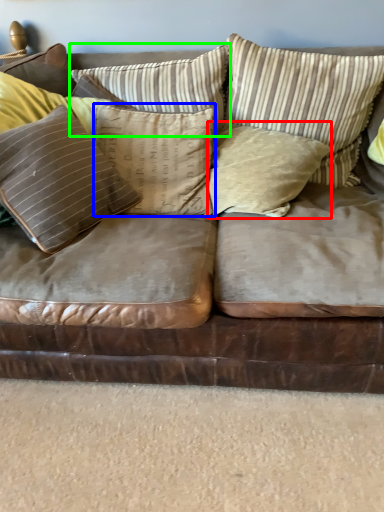
Question: Considering the real-world distances, which object is farthest from pillow (highlighted by a red box)? pillow (highlighted by a blue box) or pillow (highlighted by a green box)?

Choices:
 (A) pillow
 (B) pillow

Answer: (B)